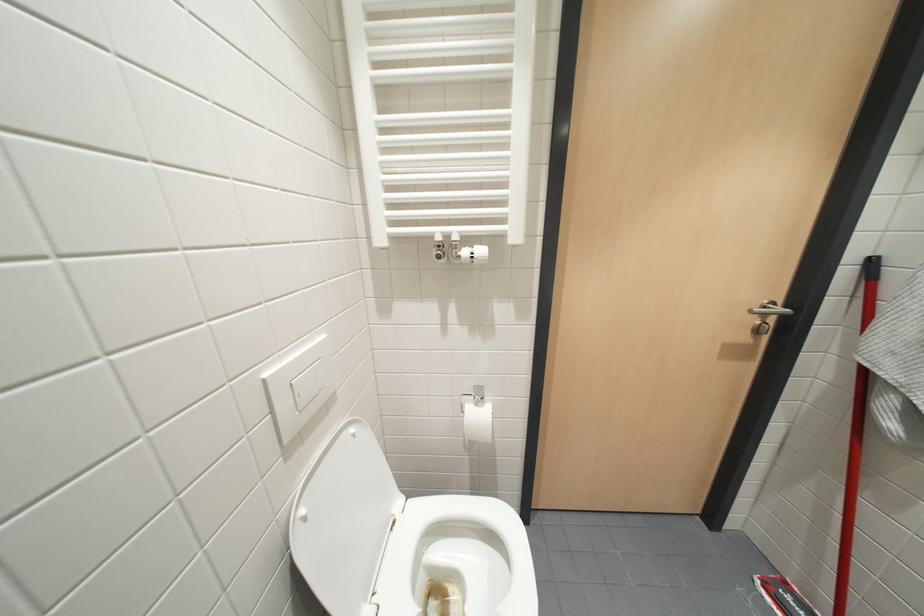
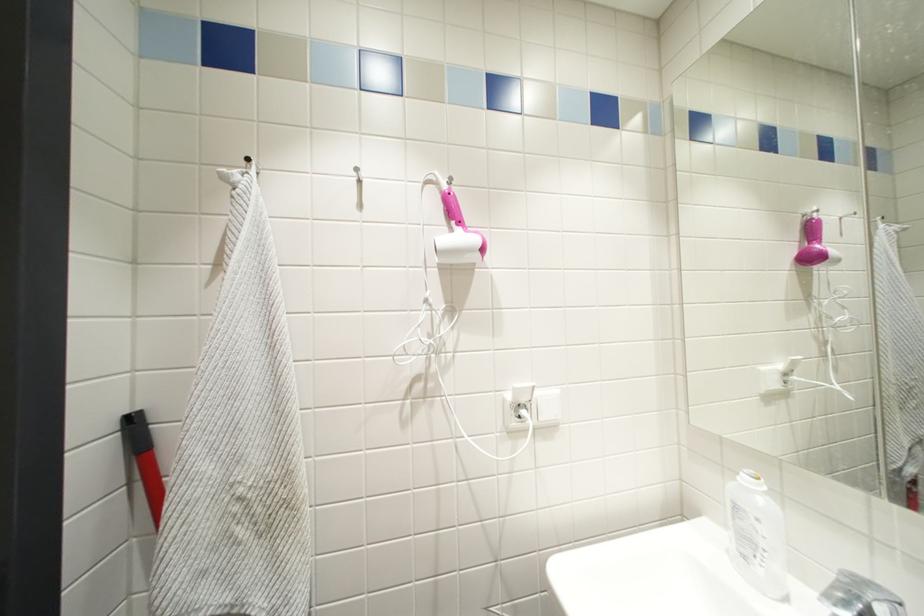
Question: The camera is either moving clockwise (left) or counter-clockwise (right) around the object. The first image is from the beginning of the video and the second image is from the end. Is the camera moving left or right when shooting the video?

Choices:
 (A) Left
 (B) Right

Answer: (A)